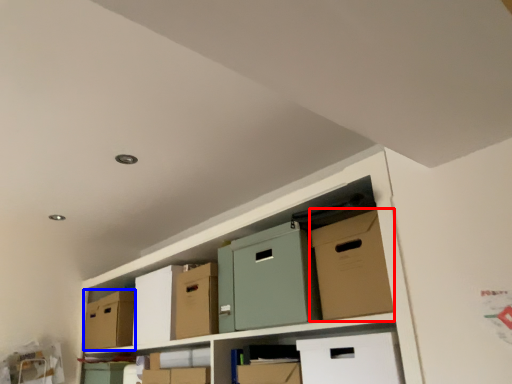
Question: Which object appears closest to the camera in this image, cardboard box (highlighted by a red box) or cardboard box (highlighted by a blue box)?

Choices:
 (A) cardboard box
 (B) cardboard box

Answer: (A)